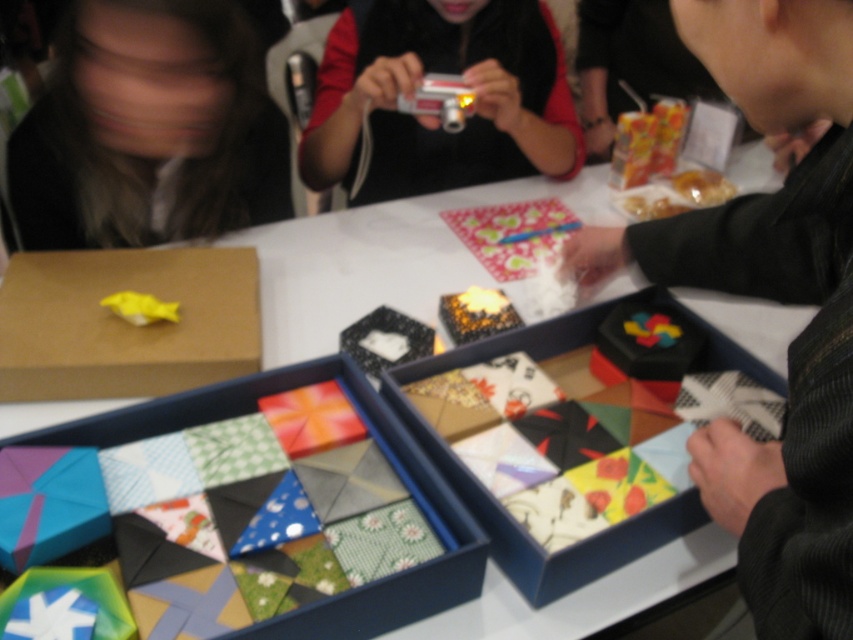
Question: Estimate the real-world distances between objects in this image. Which object is closer to the brown cardboard box at center-left?

Choices:
 (A) matte black camera at center
 (B) blurred hair at left
 (C) silky black kimono at right

Answer: (B)

Question: Can you confirm if matte black camera at center is smaller than colorful paper puzzle pieces at center?

Choices:
 (A) yes
 (B) no

Answer: (B)

Question: Considering the real-world distances, which object is closest to the brown cardboard box at center-left?

Choices:
 (A) matte cardboard box at center
 (B) colorful paper puzzle pieces at center
 (C) silky black kimono at right
 (D) colorful paper box at center

Answer: (A)

Question: Among these points, which one is farthest from the camera?

Choices:
 (A) (824, 566)
 (B) (190, 150)

Answer: (B)

Question: Does silky black kimono at right have a larger size compared to colorful paper box at center?

Choices:
 (A) no
 (B) yes

Answer: (B)

Question: Is silky black kimono at right closer to camera compared to colorful paper box at center?

Choices:
 (A) yes
 (B) no

Answer: (A)